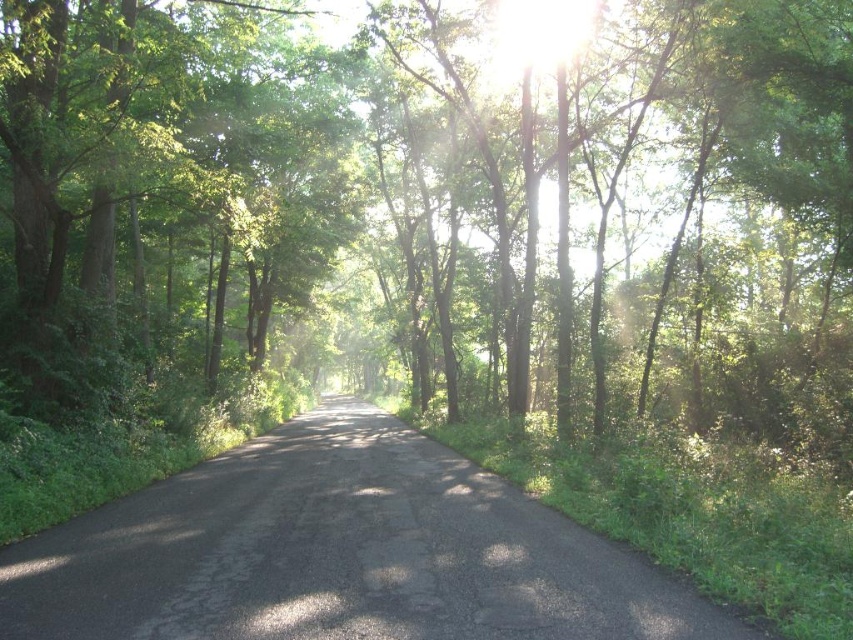
Question: Does green leafy tree at center appear under green leafy tree at left?

Choices:
 (A) yes
 (B) no

Answer: (B)

Question: Based on their relative distances, which object is nearer to the black asphalt road at center?

Choices:
 (A) green leafy tree at left
 (B) green leafy tree at center

Answer: (A)

Question: Which point appears closest to the camera in this image?

Choices:
 (A) (235, 24)
 (B) (344, 579)
 (C) (505, 220)

Answer: (B)

Question: Is black asphalt road at center closer to camera compared to green leafy tree at left?

Choices:
 (A) yes
 (B) no

Answer: (A)

Question: Can you confirm if green leafy tree at center is thinner than green leafy tree at left?

Choices:
 (A) yes
 (B) no

Answer: (B)

Question: Among these objects, which one is farthest from the camera?

Choices:
 (A) black asphalt road at center
 (B) green leafy tree at center
 (C) green leafy tree at left

Answer: (B)